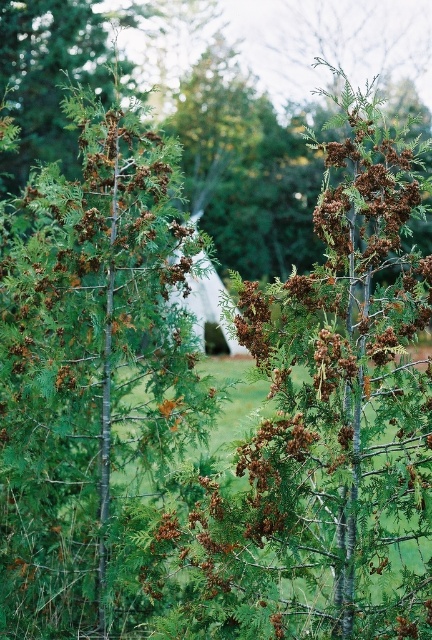
Is point (263, 358) farther from camera compared to point (32, 436)?

That is False.

The height and width of the screenshot is (640, 432). Describe the element at coordinates (327, 422) in the screenshot. I see `brown textured tree at center` at that location.

Find the location of `brown textured tree at center`. brown textured tree at center is located at coordinates (327, 422).